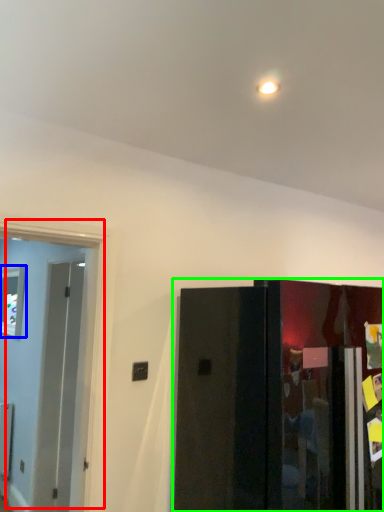
Question: Based on their relative distances, which object is farther from door (highlighted by a red box)? Choose from window (highlighted by a blue box) and door (highlighted by a green box).

Choices:
 (A) window
 (B) door

Answer: (B)